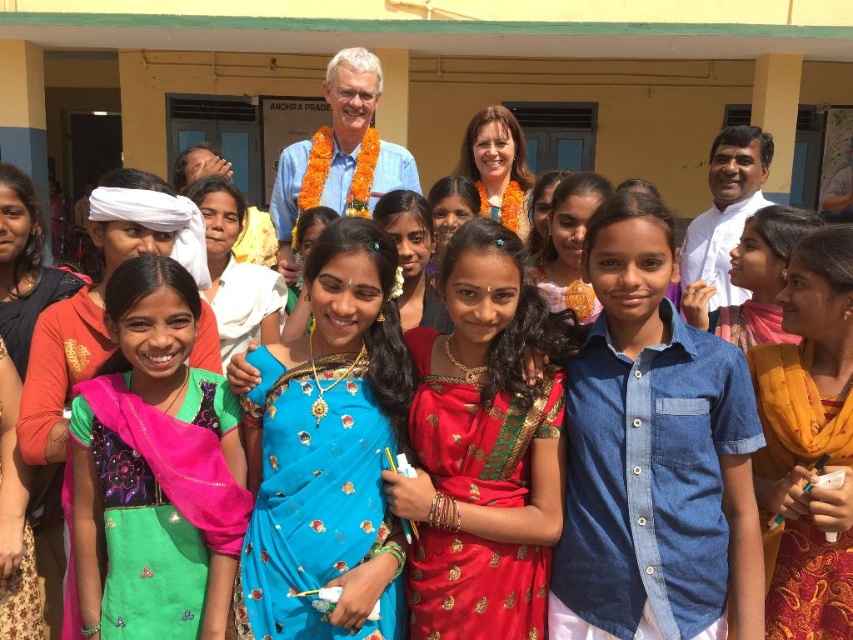
Question: Is blue silk saree at center to the left of green silk saree at center from the viewer's perspective?

Choices:
 (A) no
 (B) yes

Answer: (A)

Question: Among these points, which one is farthest from the camera?

Choices:
 (A) (601, 273)
 (B) (271, 550)
 (C) (483, 632)
 (D) (200, 468)

Answer: (D)

Question: Which of the following is the farthest from the observer?

Choices:
 (A) blue silk saree at center
 (B) shiny red sari at center
 (C) denim shirt at center
 (D) green silk saree at center

Answer: (D)

Question: Can you confirm if shiny red sari at center is positioned below green silk saree at center?

Choices:
 (A) yes
 (B) no

Answer: (B)

Question: Does denim shirt at center have a smaller size compared to green silk saree at center?

Choices:
 (A) no
 (B) yes

Answer: (A)

Question: Based on their relative distances, which object is farther from the shiny red sari at center?

Choices:
 (A) blue silk saree at center
 (B) green silk saree at center
 (C) denim shirt at center

Answer: (B)